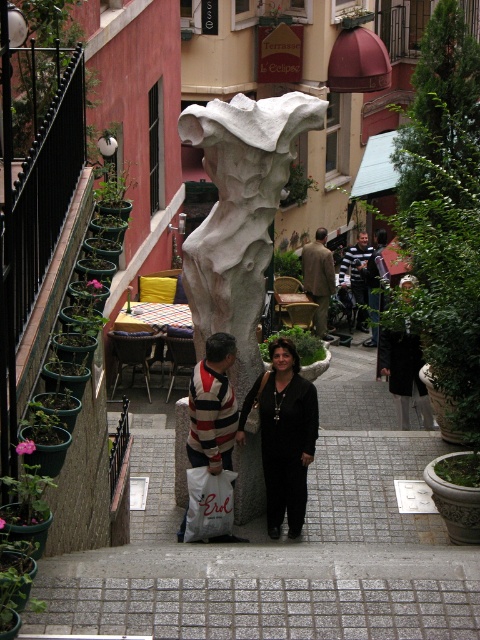
Which is more to the left, brown wool coat at center or black glossy dress at center?

Positioned to the left is brown wool coat at center.

Is point (303, 260) positioned in front of point (379, 304)?

Yes.

Locate an element on the screen. This screenshot has height=640, width=480. brown wool coat at center is located at coordinates (319, 278).

Which of these two, white stone statue at center or black glossy dress at center, stands taller?

Standing taller between the two is white stone statue at center.

Which is behind, point (216, 112) or point (379, 273)?

Point (379, 273)

Where is `white stone statue at center`? The height and width of the screenshot is (640, 480). white stone statue at center is located at coordinates (240, 212).

Which is more to the right, white stone statue at center or brown wool coat at center?

brown wool coat at center

Is point (235, 320) behind point (324, 228)?

No.

Identify the location of white stone statue at center. The height and width of the screenshot is (640, 480). (240, 212).